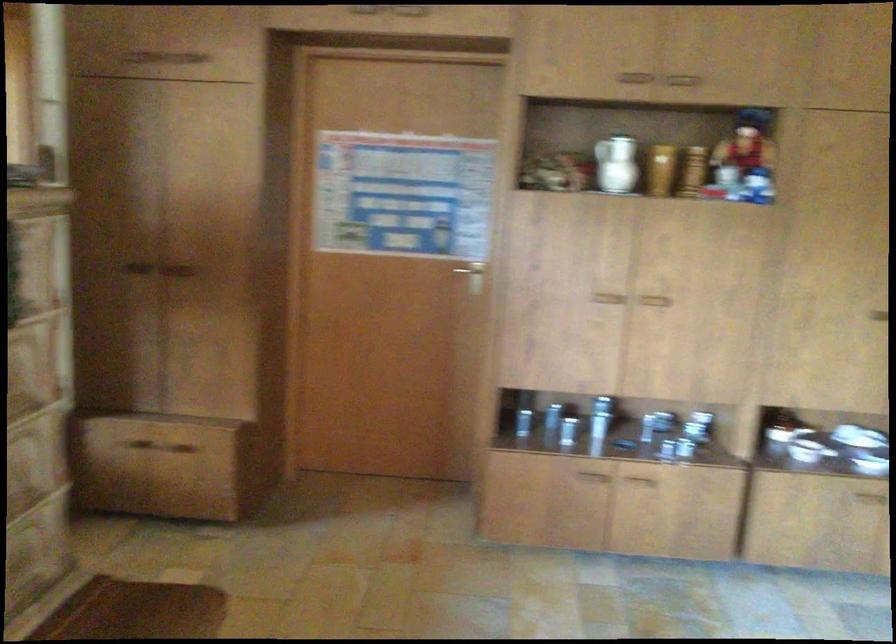
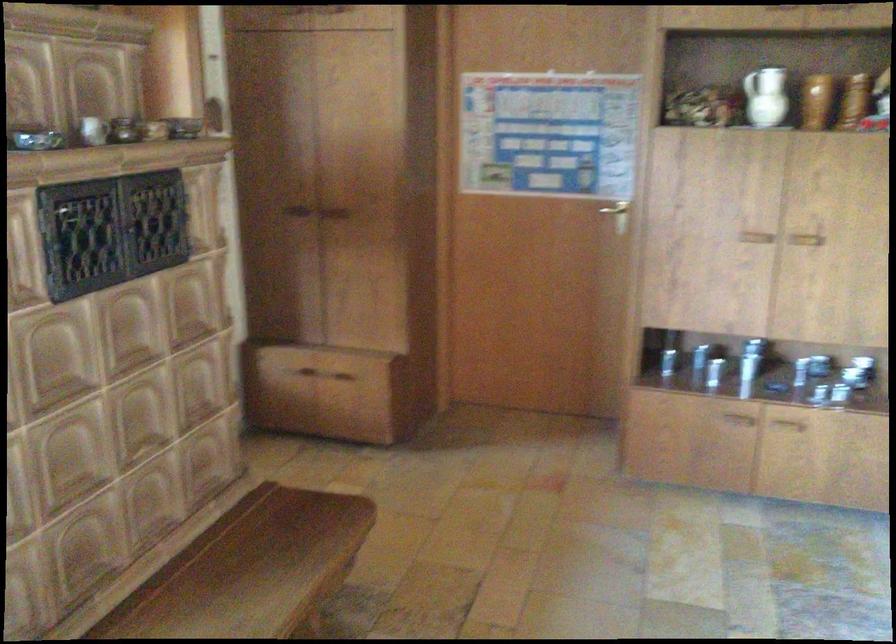
Find the pixel in the second image that matches (x=615, y=165) in the first image.

(764, 96)